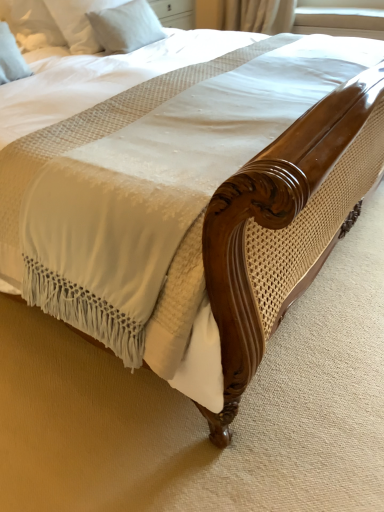
Question: Does white soft pillow at upper left, acting as the first pillow starting from the right, appear on the right side of white fabric at upper right?

Choices:
 (A) no
 (B) yes

Answer: (A)

Question: From the image's perspective, is white soft pillow at upper left, which is the 2th pillow in front-to-back order, above white fabric at upper right?

Choices:
 (A) yes
 (B) no

Answer: (B)

Question: Does white soft pillow at upper left, marked as the 2th pillow in a left-to-right arrangement, lie in front of white fabric at upper right?

Choices:
 (A) no
 (B) yes

Answer: (B)

Question: Could you tell me if white soft pillow at upper left, which is the 2th pillow in front-to-back order, is turned towards white fabric at upper right?

Choices:
 (A) no
 (B) yes

Answer: (A)

Question: Can you see white soft pillow at upper left, marked as the 2th pillow in a left-to-right arrangement, touching white fabric at upper right?

Choices:
 (A) yes
 (B) no

Answer: (B)

Question: From the image's perspective, is white soft pillow at upper left, placed as the 2th pillow when sorted from back to front, above or below white fabric at upper right?

Choices:
 (A) below
 (B) above

Answer: (A)

Question: Is white soft pillow at upper left, positioned as the 2th pillow in right-to-left order, in front of or behind white fabric at upper right in the image?

Choices:
 (A) behind
 (B) front

Answer: (B)

Question: Considering the positions of white soft pillow at upper left, positioned as the 1th pillow in left-to-right order, and white fabric at upper right in the image, is white soft pillow at upper left, positioned as the 1th pillow in left-to-right order, bigger or smaller than white fabric at upper right?

Choices:
 (A) small
 (B) big

Answer: (A)

Question: From a real-world perspective, is white soft pillow at upper left, placed as the 2th pillow when sorted from back to front, physically located above or below white fabric at upper right?

Choices:
 (A) above
 (B) below

Answer: (A)

Question: Is white soft pillow at upper left, the first pillow from the back, in front of or behind white soft pillow at upper left, positioned as the 1th pillow in left-to-right order, in the image?

Choices:
 (A) behind
 (B) front

Answer: (A)

Question: From the image's perspective, is white soft pillow at upper left, acting as the first pillow starting from the right, positioned above or below white soft pillow at upper left, positioned as the 2th pillow in right-to-left order?

Choices:
 (A) above
 (B) below

Answer: (A)

Question: Does point (157, 25) appear closer or farther from the camera than point (39, 42)?

Choices:
 (A) closer
 (B) farther

Answer: (B)

Question: Is white soft pillow at upper left, marked as the 2th pillow in a left-to-right arrangement, taller or shorter than white soft pillow at upper left, positioned as the 2th pillow in right-to-left order?

Choices:
 (A) tall
 (B) short

Answer: (B)

Question: In terms of height, does white soft pillow at upper left, acting as the first pillow starting from the right, look taller or shorter compared to white fabric at upper right?

Choices:
 (A) short
 (B) tall

Answer: (B)

Question: From the image's perspective, is white soft pillow at upper left, the first pillow from the back, positioned above or below white fabric at upper right?

Choices:
 (A) below
 (B) above

Answer: (A)